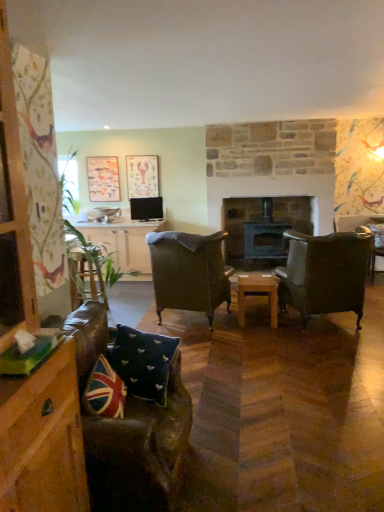
Question: From the image's perspective, is wooden table at center on top of matte wooden picture frame at upper left, arranged as the 2th picture frame when viewed from the right?

Choices:
 (A) no
 (B) yes

Answer: (A)

Question: From a real-world perspective, is wooden table at center located beneath matte wooden picture frame at upper left, arranged as the 2th picture frame when viewed from the right?

Choices:
 (A) no
 (B) yes

Answer: (B)

Question: Is there a large distance between wooden table at center and matte wooden picture frame at upper left, the first picture frame positioned from the left?

Choices:
 (A) yes
 (B) no

Answer: (A)

Question: Can we say wooden table at center lies outside matte wooden picture frame at upper left, arranged as the 2th picture frame when viewed from the right?

Choices:
 (A) no
 (B) yes

Answer: (B)

Question: Does wooden table at center appear on the right side of matte wooden picture frame at upper left, arranged as the 2th picture frame when viewed from the right?

Choices:
 (A) no
 (B) yes

Answer: (B)

Question: Is union jack fabric pillow at lower left, which appears as the first pillow when viewed from the front, bigger or smaller than matte wooden picture frame at upper left, the first picture frame positioned from the left?

Choices:
 (A) small
 (B) big

Answer: (A)

Question: Looking at their shapes, would you say union jack fabric pillow at lower left, which appears as the first pillow when viewed from the front, is wider or thinner than matte wooden picture frame at upper left, arranged as the 2th picture frame when viewed from the right?

Choices:
 (A) wide
 (B) thin

Answer: (A)

Question: Considering the positions of point (107, 412) and point (87, 174), is point (107, 412) closer or farther from the camera than point (87, 174)?

Choices:
 (A) closer
 (B) farther

Answer: (A)

Question: From the image's perspective, relative to matte wooden picture frame at upper left, arranged as the 2th picture frame when viewed from the right, is union jack fabric pillow at lower left, which appears as the first pillow when viewed from the front, above or below?

Choices:
 (A) above
 (B) below

Answer: (B)

Question: From the image's perspective, relative to matte pink paper at upper center, the second picture frame viewed from the left, is matte wooden picture frame at upper left, arranged as the 2th picture frame when viewed from the right, above or below?

Choices:
 (A) below
 (B) above

Answer: (A)

Question: From a real-world perspective, is matte wooden picture frame at upper left, the first picture frame positioned from the left, positioned above or below matte pink paper at upper center, which is counted as the 1th picture frame, starting from the right?

Choices:
 (A) below
 (B) above

Answer: (A)

Question: In the image, is matte wooden picture frame at upper left, arranged as the 2th picture frame when viewed from the right, positioned in front of or behind matte pink paper at upper center, which is counted as the 1th picture frame, starting from the right?

Choices:
 (A) behind
 (B) front

Answer: (A)

Question: Is matte wooden picture frame at upper left, the first picture frame positioned from the left, inside or outside of matte pink paper at upper center, which is counted as the 1th picture frame, starting from the right?

Choices:
 (A) inside
 (B) outside

Answer: (B)

Question: Considering the positions of velvet green armchair at right, positioned as the third chair in front-to-back order, and union jack fabric pillow at lower left, which appears as the first pillow when viewed from the front, in the image, is velvet green armchair at right, positioned as the third chair in front-to-back order, taller or shorter than union jack fabric pillow at lower left, which appears as the first pillow when viewed from the front,?

Choices:
 (A) short
 (B) tall

Answer: (B)

Question: Is point (382, 252) closer or farther from the camera than point (114, 390)?

Choices:
 (A) closer
 (B) farther

Answer: (B)